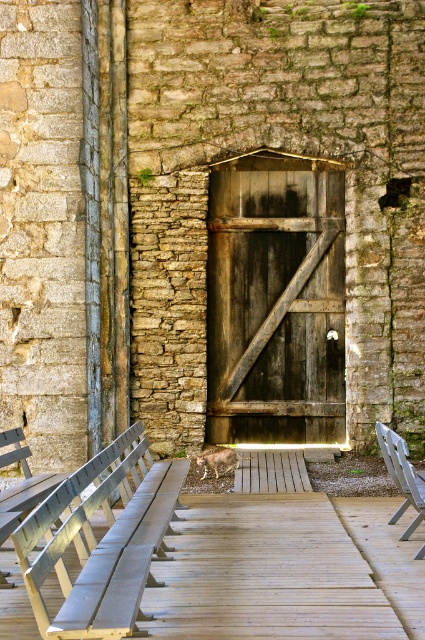
Based on the photo, you are a delivery person with a package that requires a 2.5 meter wide space to place. You see the dark brown wooden door at center and the wooden bench at lower left. Is there enough space between them to place your package?

The dark brown wooden door at center and wooden bench at lower left are 3.20 meters apart from each other, which is wider than the required 2.5 meters. Therefore, there is enough space between them to place the package.

You are standing at the entrance of the rustic stone building and want to sit down. There is a wooden bench at lower left and a metallic silver bench at center. Which bench is closer to you?

The wooden bench at lower left is closer to you because it is positioned over the metallic silver bench at center, indicating it is in front and nearer to your current position.

You are a painter who needs to decide which object to paint first. The dark brown wooden door at center and the wooden bench at lower left are both in your view. Based on their sizes, which one should you tackle first if you want to start with the larger object?

The dark brown wooden door at center is much taller than the wooden bench at lower left, so you should paint the dark brown wooden door at center first since it is larger.